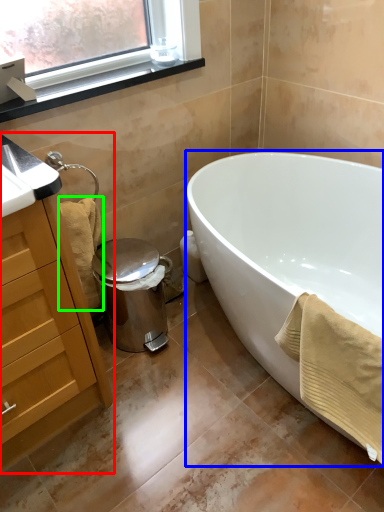
Question: Which is nearer to the cabinetry (highlighted by a red box)? bathtub (highlighted by a blue box) or bath towel (highlighted by a green box).

Choices:
 (A) bathtub
 (B) bath towel

Answer: (B)